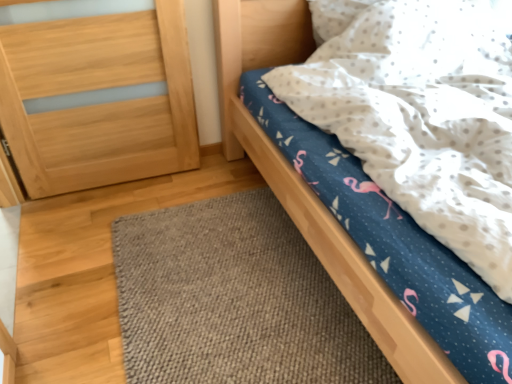
Question: Is light brown wood at left at the right side of blue fabric bed at upper right?

Choices:
 (A) no
 (B) yes

Answer: (A)

Question: Is light brown wood at left outside blue fabric bed at upper right?

Choices:
 (A) no
 (B) yes

Answer: (B)

Question: Is light brown wood at left facing towards blue fabric bed at upper right?

Choices:
 (A) no
 (B) yes

Answer: (A)

Question: Is the depth of light brown wood at left greater than that of blue fabric bed at upper right?

Choices:
 (A) yes
 (B) no

Answer: (A)

Question: Is light brown wood at left shorter than blue fabric bed at upper right?

Choices:
 (A) no
 (B) yes

Answer: (B)

Question: From the image's perspective, does light brown wood at left appear higher than blue fabric bed at upper right?

Choices:
 (A) no
 (B) yes

Answer: (B)

Question: Considering the relative sizes of blue fabric bed at upper right and brown woven mat at lower center in the image provided, is blue fabric bed at upper right bigger than brown woven mat at lower center?

Choices:
 (A) yes
 (B) no

Answer: (A)

Question: Considering the relative sizes of blue fabric bed at upper right and brown woven mat at lower center in the image provided, is blue fabric bed at upper right taller than brown woven mat at lower center?

Choices:
 (A) yes
 (B) no

Answer: (A)

Question: Could you tell me if blue fabric bed at upper right is facing brown woven mat at lower center?

Choices:
 (A) yes
 (B) no

Answer: (B)

Question: Is blue fabric bed at upper right not near brown woven mat at lower center?

Choices:
 (A) no
 (B) yes

Answer: (A)

Question: Would you say brown woven mat at lower center is part of blue fabric bed at upper right's contents?

Choices:
 (A) no
 (B) yes

Answer: (A)

Question: Is blue fabric bed at upper right to the right of brown woven mat at lower center from the viewer's perspective?

Choices:
 (A) no
 (B) yes

Answer: (B)

Question: From a real-world perspective, is brown woven mat at lower center physically above blue fabric bed at upper right?

Choices:
 (A) yes
 (B) no

Answer: (B)